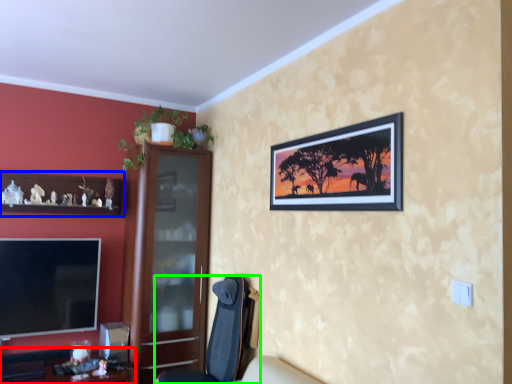
Question: Considering the real-world distances, which object is farthest from desk (highlighted by a red box)? cabinetry (highlighted by a blue box) or chair (highlighted by a green box)?

Choices:
 (A) cabinetry
 (B) chair

Answer: (A)